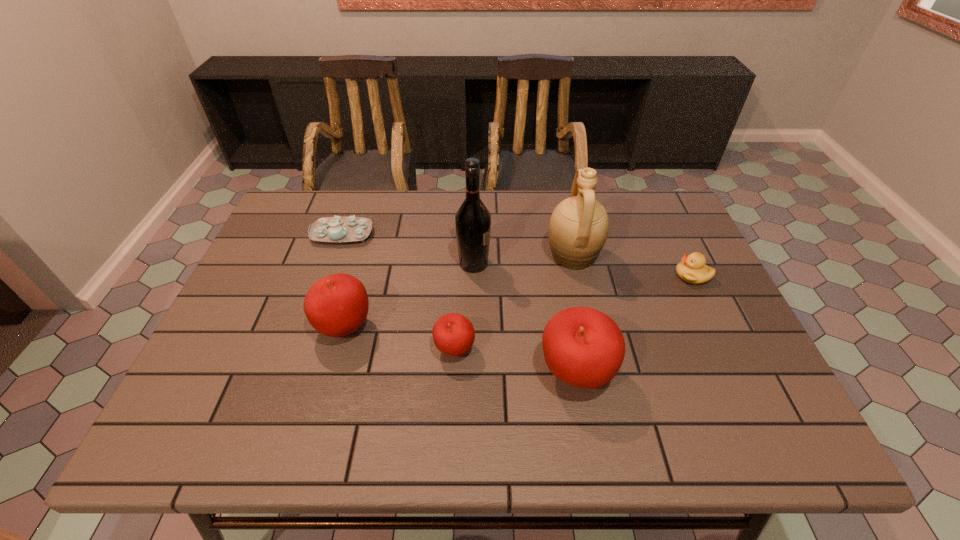
Identify the location of free region located 0.370m on the left of the second apple from right to left. This screenshot has width=960, height=540. (275, 350).

Locate an element on the screen. vacant point located on the back of the rightmost apple is located at coordinates point(558,273).

Where is `blank space located on the label of the wine bottle`? blank space located on the label of the wine bottle is located at coordinates (630, 264).

At what (x,y) coordinates should I click in order to perform the action: click on vacant region located 0.240m on the back of the second tallest object. Please return your answer as a coordinate pair (x, y). Looking at the image, I should click on (559, 191).

Identify the location of vacant region located 0.050m on the right of the chinaware. (390, 234).

Where is `vacant space situated on the beak of the rightmost object`? vacant space situated on the beak of the rightmost object is located at coordinates (536, 275).

Identify the location of vacant space located 0.310m on the beak of the rightmost object. click(x=562, y=275).

This screenshot has height=540, width=960. Find the location of `vacant space located 0.080m on the beak of the rightmost object`. vacant space located 0.080m on the beak of the rightmost object is located at coordinates (646, 275).

Where is `pitcher that is at the far edge`? Image resolution: width=960 pixels, height=540 pixels. pitcher that is at the far edge is located at coordinates (578, 228).

Where is `chinaware at the far edge`? The width and height of the screenshot is (960, 540). chinaware at the far edge is located at coordinates (331, 229).